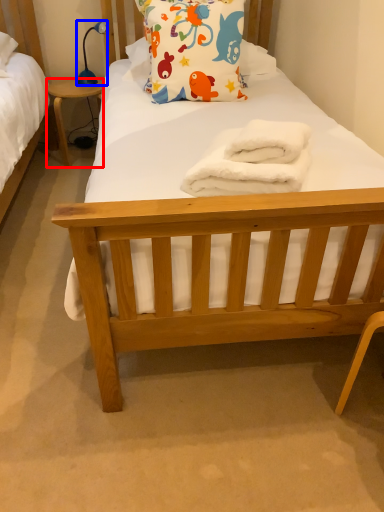
Question: Which of the following is the closest to the observer, desk (highlighted by a red box) or lamp (highlighted by a blue box)?

Choices:
 (A) desk
 (B) lamp

Answer: (B)